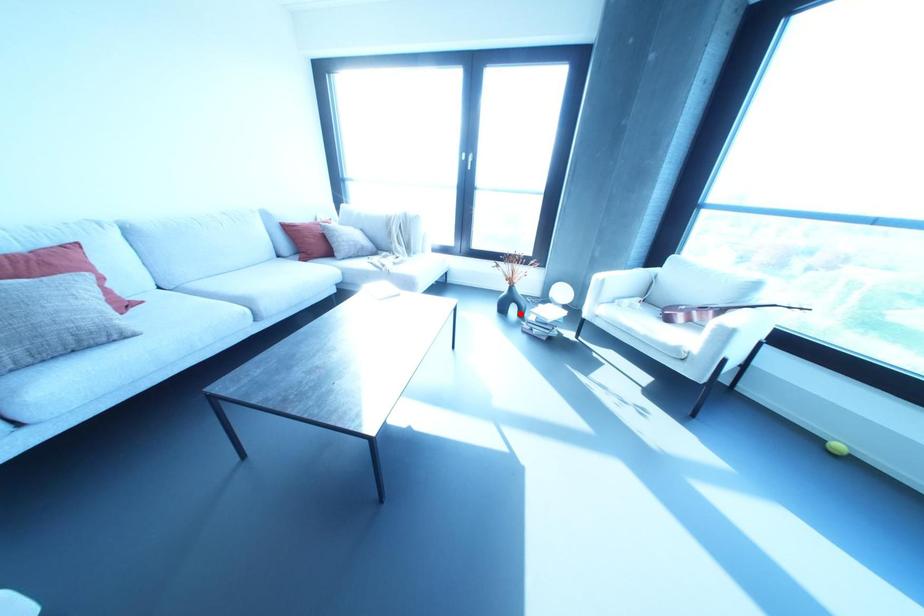
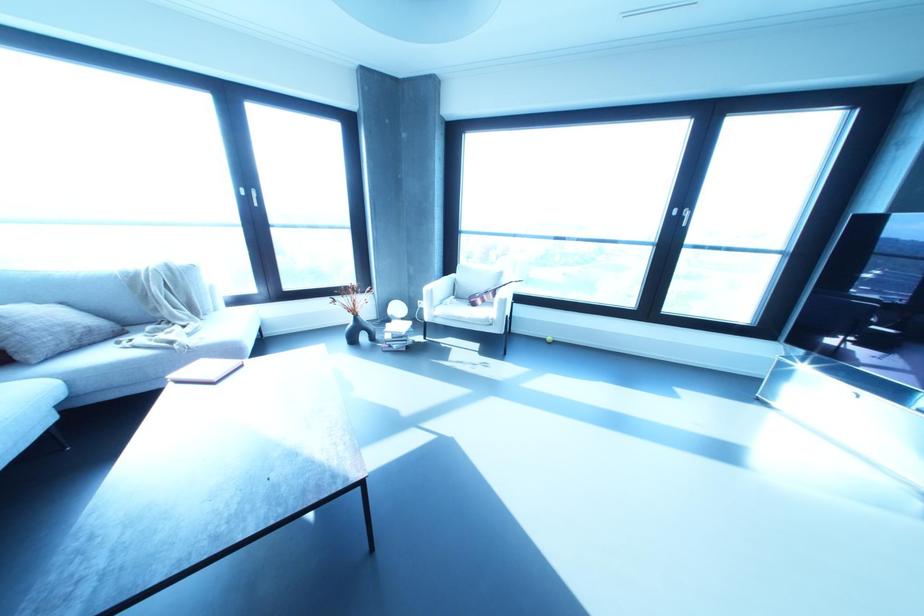
The point at the highlighted location is marked in the first image. Where is the corresponding point in the second image?

(371, 338)